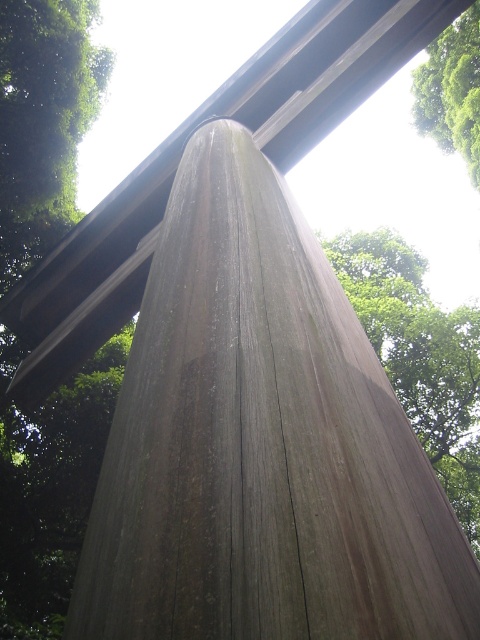
Question: Which of the following is the closest to the observer?

Choices:
 (A) weathered wood pillar at center
 (B) green leafy tree at upper right

Answer: (A)

Question: Does weathered wood pillar at center appear on the right side of green leafy tree at upper right?

Choices:
 (A) no
 (B) yes

Answer: (A)

Question: Among these objects, which one is farthest from the camera?

Choices:
 (A) green leafy tree at upper right
 (B) weathered wood pillar at center

Answer: (A)

Question: From the image, what is the correct spatial relationship of weathered wood pillar at center in relation to green leafy tree at upper right?

Choices:
 (A) left
 (B) right

Answer: (A)

Question: Considering the relative positions of weathered wood pillar at center and green leafy tree at upper right in the image provided, where is weathered wood pillar at center located with respect to green leafy tree at upper right?

Choices:
 (A) above
 (B) below

Answer: (B)

Question: Which of the following is the closest to the observer?

Choices:
 (A) green leafy tree at upper right
 (B) weathered wood pillar at center

Answer: (B)